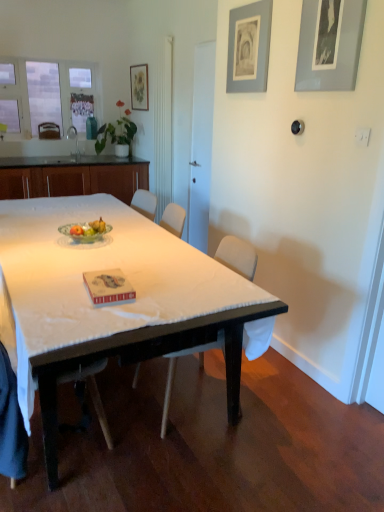
Image resolution: width=384 pixels, height=512 pixels. Identify the location of vacant space to the right of white plastic chair at center, positioned as the 2th chair in back-to-front order. (278, 403).